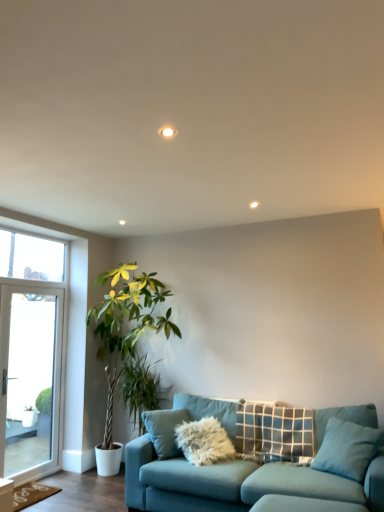
Question: Considering the relative sizes of blue fabric pillow at lower right, which appears as the first pillow when viewed from the front, and teal fabric couch at lower center in the image provided, is blue fabric pillow at lower right, which appears as the first pillow when viewed from the front, bigger than teal fabric couch at lower center?

Choices:
 (A) no
 (B) yes

Answer: (A)

Question: Considering the relative positions of blue fabric pillow at lower right, acting as the second pillow starting from the back, and teal fabric couch at lower center in the image provided, is blue fabric pillow at lower right, acting as the second pillow starting from the back, in front of teal fabric couch at lower center?

Choices:
 (A) no
 (B) yes

Answer: (A)

Question: Is blue fabric pillow at lower right, which appears as the first pillow when viewed from the front, positioned beyond the bounds of teal fabric couch at lower center?

Choices:
 (A) yes
 (B) no

Answer: (B)

Question: From the image's perspective, does blue fabric pillow at lower right, acting as the second pillow starting from the back, appear lower than teal fabric couch at lower center?

Choices:
 (A) no
 (B) yes

Answer: (A)

Question: Is blue fabric pillow at lower right, which appears as the first pillow when viewed from the front, touching teal fabric couch at lower center?

Choices:
 (A) yes
 (B) no

Answer: (B)

Question: Does blue fabric pillow at lower right, acting as the second pillow starting from the back, have a smaller size compared to teal fabric couch at lower center?

Choices:
 (A) yes
 (B) no

Answer: (A)

Question: Does green leafy plant at left have a smaller size compared to green leafy plant at left?

Choices:
 (A) no
 (B) yes

Answer: (A)

Question: From the image's perspective, is green leafy plant at left on top of green leafy plant at left?

Choices:
 (A) yes
 (B) no

Answer: (A)

Question: Is green leafy plant at left far from green leafy plant at left?

Choices:
 (A) yes
 (B) no

Answer: (B)

Question: From a real-world perspective, is green leafy plant at left below green leafy plant at left?

Choices:
 (A) no
 (B) yes

Answer: (A)

Question: Can you confirm if green leafy plant at left is wider than green leafy plant at left?

Choices:
 (A) no
 (B) yes

Answer: (B)

Question: Is green leafy plant at left closer to camera compared to green leafy plant at left?

Choices:
 (A) yes
 (B) no

Answer: (A)

Question: Does plaid fabric pillow at center, marked as the first pillow in a back-to-front arrangement, appear on the left side of clear glass door at left?

Choices:
 (A) no
 (B) yes

Answer: (A)